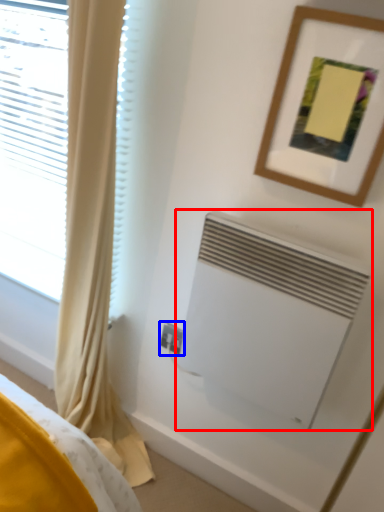
Question: Which point is closer to the camera, air conditioning (highlighted by a red box) or electric outlet (highlighted by a blue box)?

Choices:
 (A) air conditioning
 (B) electric outlet

Answer: (A)